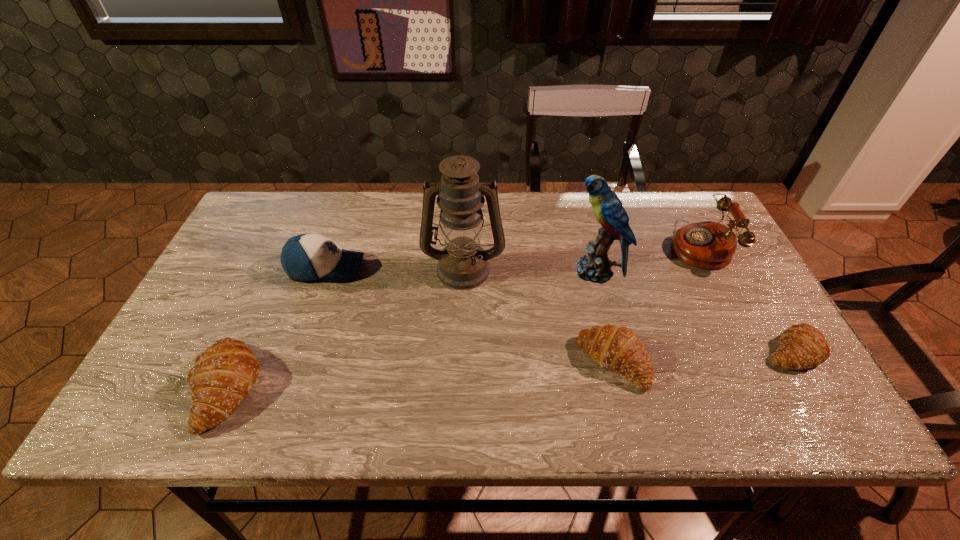
To achieve even spacing by inserting another crescent_roll among them, please point to a vacant spot for this new crescent_roll. Please provide its 2D coordinates. Your answer should be formatted as a tuple, i.e. [(x, y)], where the tuple contains the x and y coordinates of a point satisfying the conditions above.

[(424, 375)]